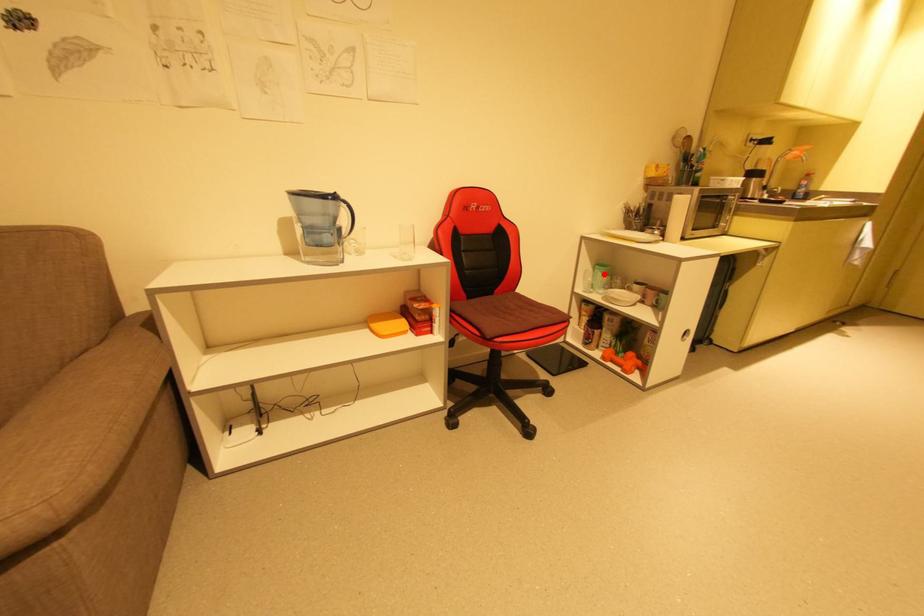
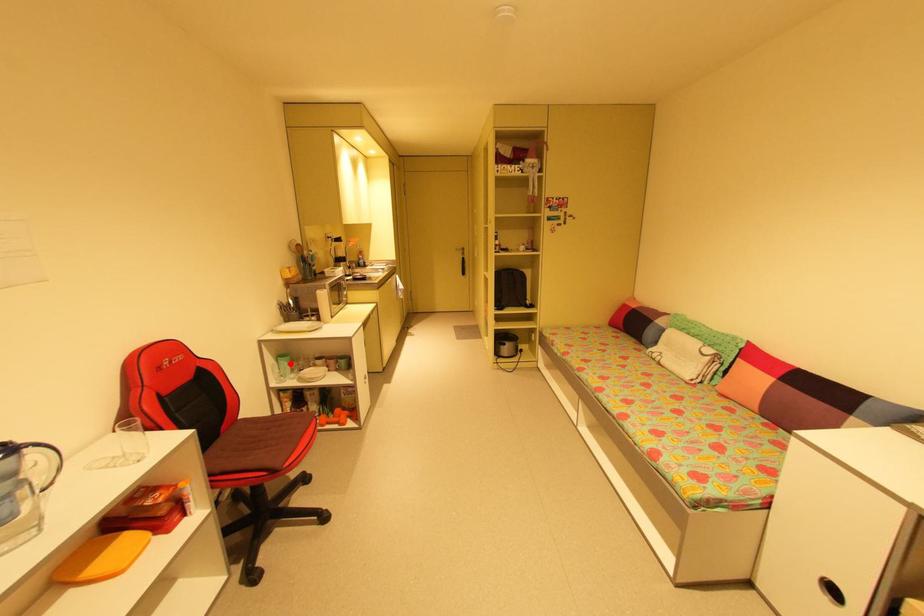
I am providing you with two images of the same scene from different viewpoints. A red point is marked on the first image and another point is marked on the second image. Does the point marked in image1 correspond to the same location as the one in image2?

Yes